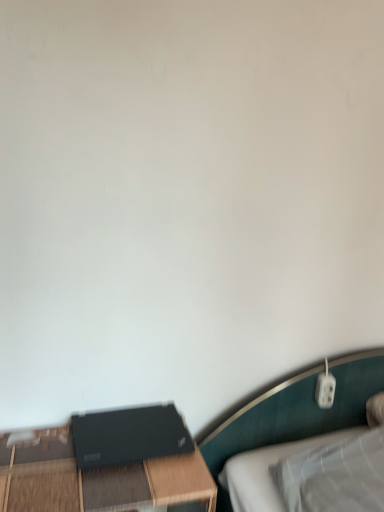
I want to click on vacant area that is in front of black matte laptop at lower left, so click(x=105, y=483).